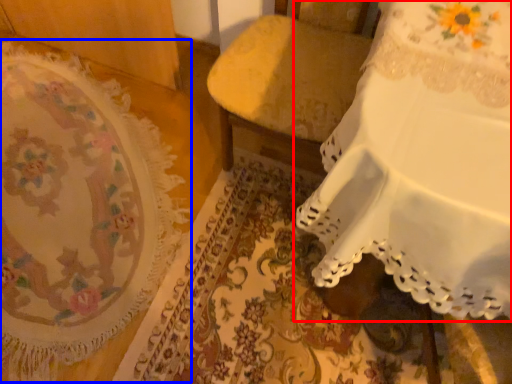
Question: Which of the following is the closest to the observer, furniture (highlighted by a red box) or mat (highlighted by a blue box)?

Choices:
 (A) furniture
 (B) mat

Answer: (A)